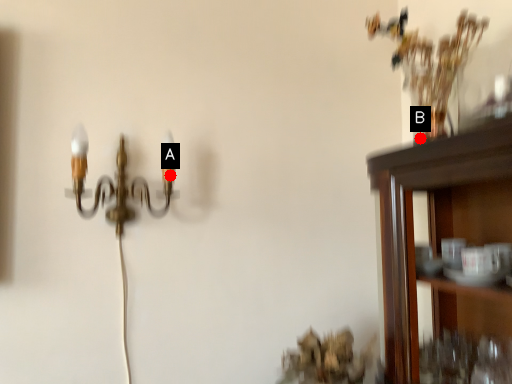
Question: Two points are circled on the image, labeled by A and B beside each circle. Which point appears closest to the camera in this image?

Choices:
 (A) A is closer
 (B) B is closer

Answer: (B)